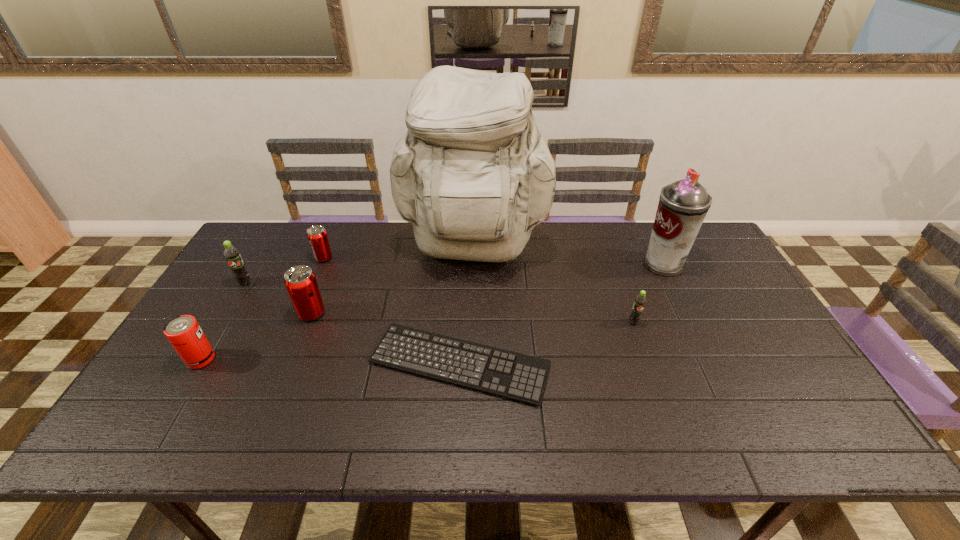
This screenshot has height=540, width=960. I want to click on vacant space located 0.130m on the back of the black computer keyboard, so click(463, 294).

Find the location of `backpack present at the far edge`. backpack present at the far edge is located at coordinates (473, 175).

Where is `aerosol can at the far edge`? This screenshot has height=540, width=960. aerosol can at the far edge is located at coordinates (683, 205).

You are a GUI agent. You are given a task and a screenshot of the screen. Output one action in this format:
    pyautogui.click(x=<x>, y=<y>)
    Task: Click on the soda can at the far edge
    
    Given the screenshot: What is the action you would take?
    pyautogui.click(x=317, y=236)

This screenshot has height=540, width=960. I want to click on soda that is at the left edge, so click(x=232, y=255).

The image size is (960, 540). I want to click on can that is at the left edge, so click(x=184, y=333).

Locate an element on the screen. Image resolution: width=960 pixels, height=540 pixels. object that is positioned at the right edge is located at coordinates (683, 205).

Locate an element on the screen. object situated at the far right corner is located at coordinates (683, 205).

Find the location of a particular element. The width and height of the screenshot is (960, 540). vacant space at the far edge is located at coordinates (553, 240).

The image size is (960, 540). I want to click on free space at the near edge of the desktop, so click(x=455, y=419).